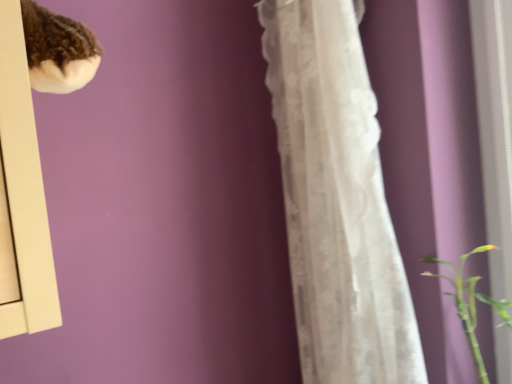
Question: Is green smooth stem at lower right completely or partially outside of white lace curtain at center?

Choices:
 (A) yes
 (B) no

Answer: (A)

Question: Is the depth of green smooth stem at lower right less than that of white lace curtain at center?

Choices:
 (A) yes
 (B) no

Answer: (B)

Question: From a real-world perspective, is green smooth stem at lower right positioned under white lace curtain at center based on gravity?

Choices:
 (A) no
 (B) yes

Answer: (B)

Question: Can you confirm if green smooth stem at lower right is positioned to the left of white lace curtain at center?

Choices:
 (A) no
 (B) yes

Answer: (A)

Question: Is white lace curtain at center a part of green smooth stem at lower right?

Choices:
 (A) yes
 (B) no

Answer: (B)

Question: Are green smooth stem at lower right and white lace curtain at center located far from each other?

Choices:
 (A) no
 (B) yes

Answer: (A)

Question: Would you consider white lace curtain at center to be distant from green smooth stem at lower right?

Choices:
 (A) no
 (B) yes

Answer: (A)

Question: Are white lace curtain at center and green smooth stem at lower right beside each other?

Choices:
 (A) no
 (B) yes

Answer: (A)

Question: From a real-world perspective, is white lace curtain at center over green smooth stem at lower right?

Choices:
 (A) no
 (B) yes

Answer: (B)

Question: Can we say white lace curtain at center lies outside green smooth stem at lower right?

Choices:
 (A) no
 (B) yes

Answer: (B)

Question: Is white lace curtain at center in front of green smooth stem at lower right?

Choices:
 (A) yes
 (B) no

Answer: (A)

Question: Considering the relative sizes of white lace curtain at center and green smooth stem at lower right in the image provided, is white lace curtain at center taller than green smooth stem at lower right?

Choices:
 (A) yes
 (B) no

Answer: (A)

Question: Does point (289, 1) appear closer or farther from the camera than point (458, 281)?

Choices:
 (A) closer
 (B) farther

Answer: (A)